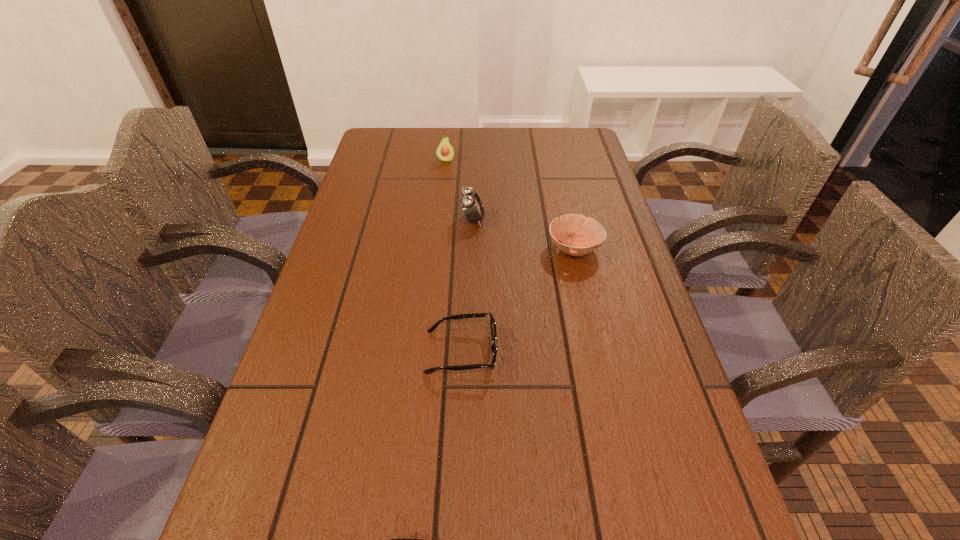
Locate an element on the screen. the fourth nearest object is located at coordinates (472, 206).

At what (x,y) coordinates should I click in order to perform the action: click on the tallest object. Please return your answer as a coordinate pair (x, y). This screenshot has width=960, height=540. Looking at the image, I should click on (472, 206).

This screenshot has width=960, height=540. I want to click on avocado, so click(x=445, y=151).

Locate an element on the screen. This screenshot has height=540, width=960. the second tallest object is located at coordinates (445, 151).

The width and height of the screenshot is (960, 540). In order to click on bowl in this screenshot , I will do `click(593, 233)`.

The image size is (960, 540). Identify the location of the third nearest object. (593, 233).

Find the location of a particular element. the fourth tallest object is located at coordinates (470, 315).

Locate an element on the screen. This screenshot has height=540, width=960. the second nearest object is located at coordinates (470, 315).

Identify the location of vacant space located on the face of the tallest object. The height and width of the screenshot is (540, 960). (576, 220).

Where is `free space located 0.190m on the cut side of the avocado`? This screenshot has height=540, width=960. free space located 0.190m on the cut side of the avocado is located at coordinates (x=442, y=199).